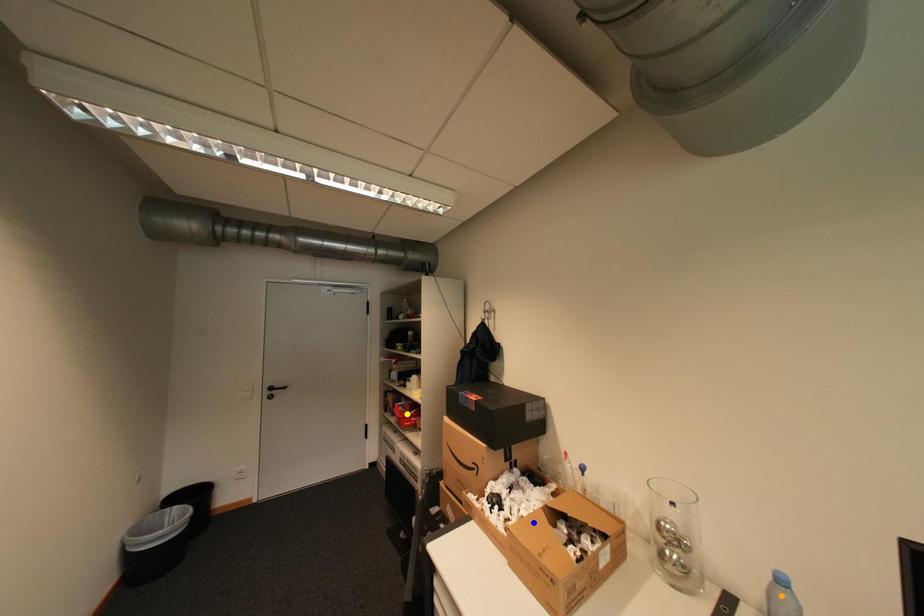
Order these from nearest to farthest:
1. yellow point
2. blue point
3. orange point

orange point → blue point → yellow point